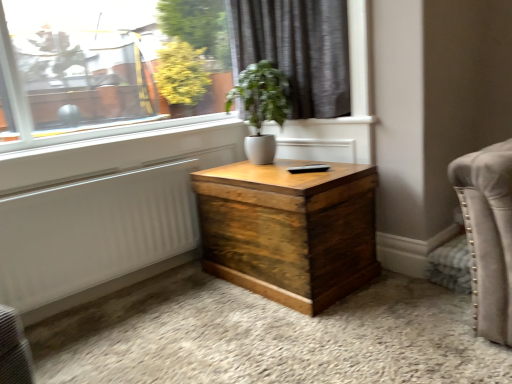
Question: Does white textured radiator at lower left appear on the left side of white glossy vase at center?

Choices:
 (A) no
 (B) yes

Answer: (B)

Question: From a real-world perspective, is white textured radiator at lower left positioned over white glossy vase at center based on gravity?

Choices:
 (A) yes
 (B) no

Answer: (B)

Question: Could you tell me if white textured radiator at lower left is turned towards white glossy vase at center?

Choices:
 (A) no
 (B) yes

Answer: (A)

Question: Does white textured radiator at lower left have a lesser height compared to white glossy vase at center?

Choices:
 (A) no
 (B) yes

Answer: (B)

Question: From a real-world perspective, is white textured radiator at lower left below white glossy vase at center?

Choices:
 (A) yes
 (B) no

Answer: (A)

Question: Is the surface of white textured radiator at lower left in direct contact with white glossy vase at center?

Choices:
 (A) no
 (B) yes

Answer: (A)

Question: From the image's perspective, is dark grey fabric curtain at upper center above white smooth window sill at upper center?

Choices:
 (A) yes
 (B) no

Answer: (A)

Question: Does dark grey fabric curtain at upper center contain white smooth window sill at upper center?

Choices:
 (A) yes
 (B) no

Answer: (B)

Question: Is dark grey fabric curtain at upper center to the right of white smooth window sill at upper center from the viewer's perspective?

Choices:
 (A) no
 (B) yes

Answer: (B)

Question: Is dark grey fabric curtain at upper center positioned in front of white smooth window sill at upper center?

Choices:
 (A) no
 (B) yes

Answer: (A)

Question: Considering the relative sizes of dark grey fabric curtain at upper center and white smooth window sill at upper center in the image provided, is dark grey fabric curtain at upper center shorter than white smooth window sill at upper center?

Choices:
 (A) yes
 (B) no

Answer: (B)

Question: Can you confirm if dark grey fabric curtain at upper center is smaller than white smooth window sill at upper center?

Choices:
 (A) no
 (B) yes

Answer: (A)

Question: From the image's perspective, is dark grey fabric curtain at upper center below white textured radiator at lower left?

Choices:
 (A) yes
 (B) no

Answer: (B)